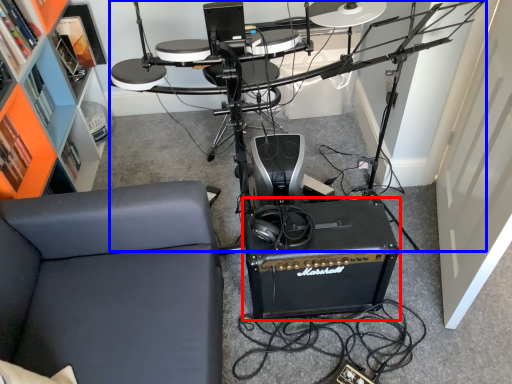
Question: Which point is further to the camera, speaker (highlighted by a red box) or computer desk (highlighted by a blue box)?

Choices:
 (A) speaker
 (B) computer desk

Answer: (A)